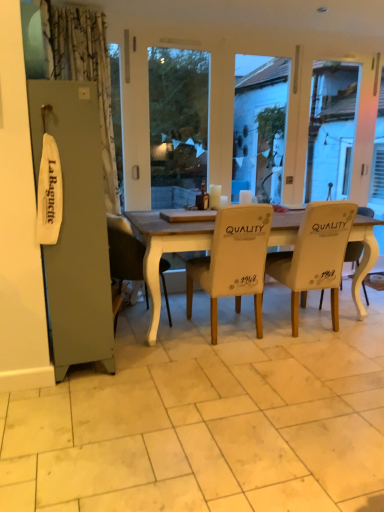
In order to click on free point to the left of white leather chair at center, the 2th chair positioned from the left in this screenshot , I will do `click(162, 343)`.